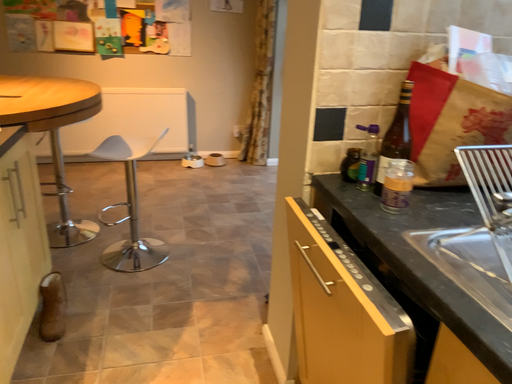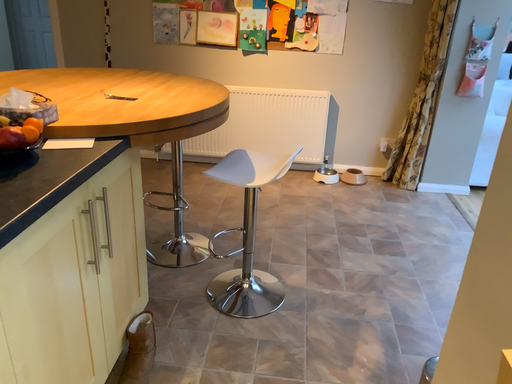
Question: Which way did the camera rotate in the video?

Choices:
 (A) rotated left
 (B) rotated right

Answer: (A)